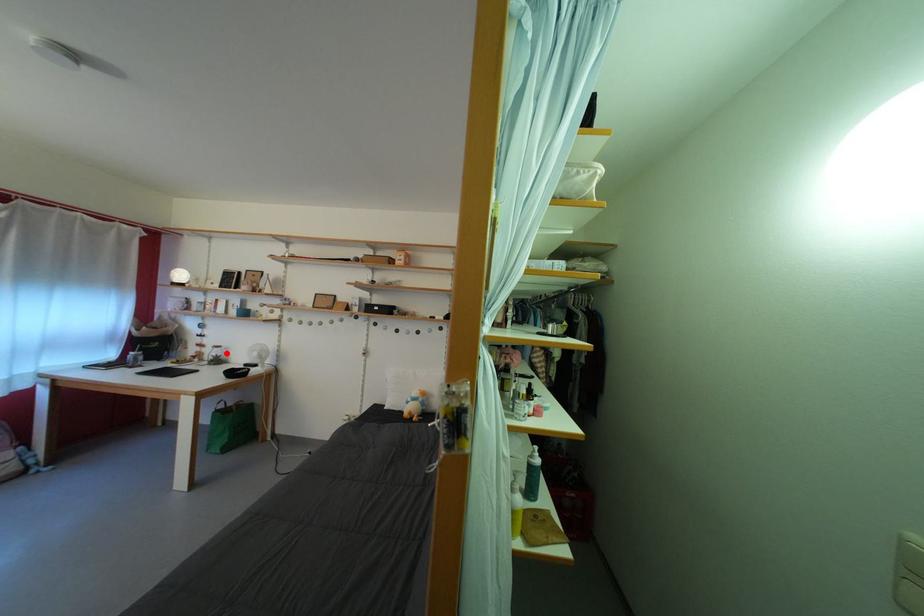
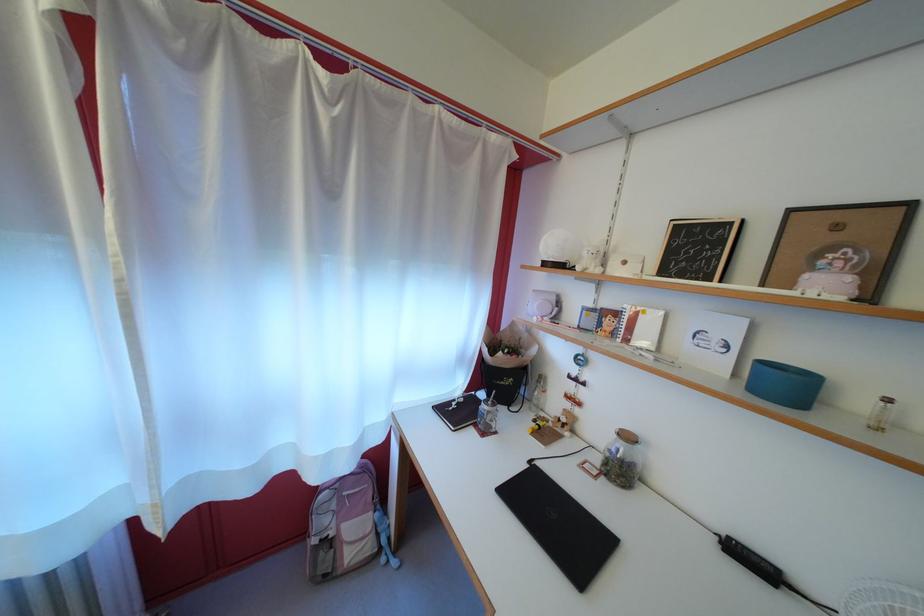
Locate, in the second image, the point that corresponds to the highlighted location in the first image.

(637, 444)